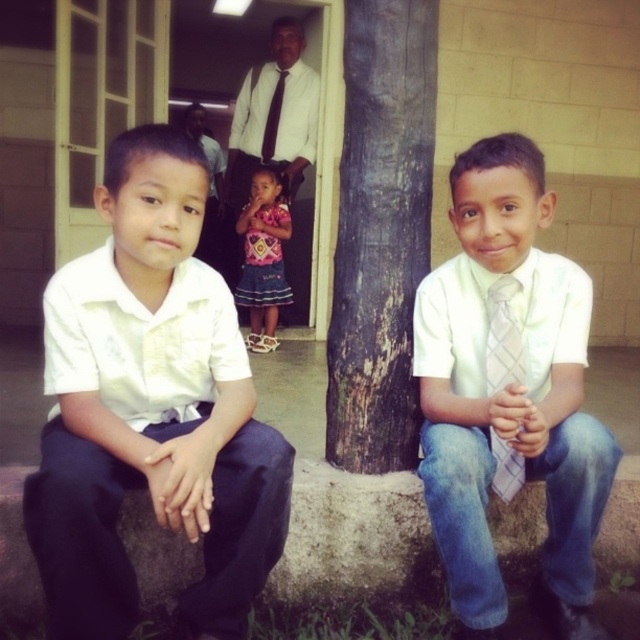
You are a photographer adjusting the camera settings to ensure both the white woven tie at center and the pink fabric dress at center are in focus. Which object should you prioritize focusing on if the depth of field is limited?

The white woven tie at center should be prioritized for focus because it is wider than the pink fabric dress at center, making it more likely to appear blurry if not properly focused.

You are a photographer trying to capture a portrait of the two boys. The white satin shirt at left and the brown rough tree trunk at center are in the frame. Based on their positions, which object is closer to the camera?

The white satin shirt at left is closer to the camera because it is positioned below the brown rough tree trunk at center, indicating it is in the foreground.